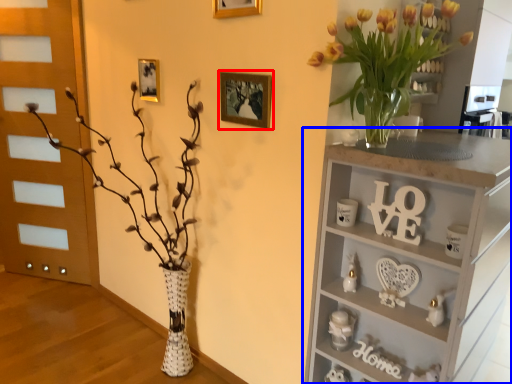
Question: Which object is closer to the camera taking this photo, picture frame (highlighted by a red box) or shelf (highlighted by a blue box)?

Choices:
 (A) picture frame
 (B) shelf

Answer: (B)